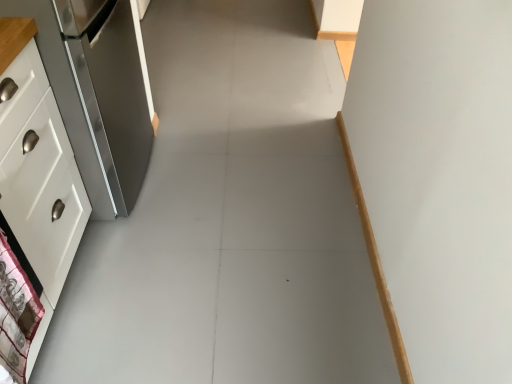
Question: Is point (1, 188) closer or farther from the camera than point (123, 92)?

Choices:
 (A) closer
 (B) farther

Answer: (A)

Question: Is white glossy cabinet at left taller or shorter than satin silver refrigerator at left?

Choices:
 (A) tall
 (B) short

Answer: (B)

Question: Which of these objects is positioned closest to the white fabric with pattern at lower left?

Choices:
 (A) satin silver refrigerator at left
 (B) white glossy cabinet at left

Answer: (B)

Question: Estimate the real-world distances between objects in this image. Which object is farther from the white glossy cabinet at left?

Choices:
 (A) white fabric with pattern at lower left
 (B) satin silver refrigerator at left

Answer: (B)